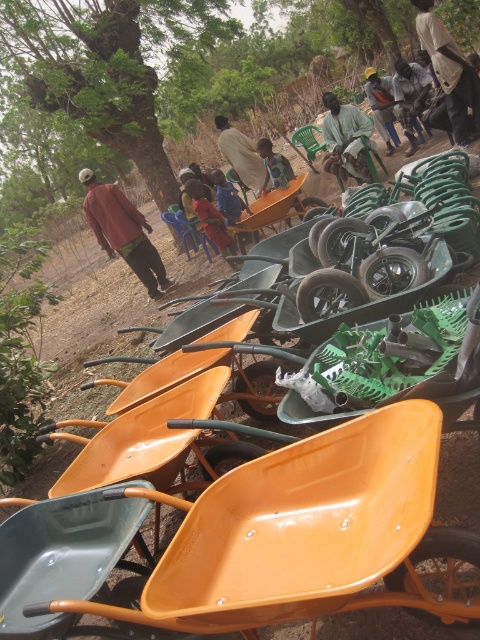
Based on the photo, how far apart are light brown fabric shirt at center and red plastic chair at center?

2.26 meters

Is point (343, 172) less distant than point (228, 241)?

No, it is behind (228, 241).

Identify the location of light brown fabric shirt at center. [346, 138].

Can you confirm if matte red shirt at left is positioned above light brown wooden chair at center?

Actually, matte red shirt at left is below light brown wooden chair at center.

Can you confirm if matte red shirt at left is shorter than light brown wooden chair at center?

No.

Is point (144, 257) behind point (282, 160)?

No, (144, 257) is in front of (282, 160).

I want to click on matte red shirt at left, so click(x=122, y=230).

Who is taller, orange plastic wheelbarrow at center or green plastic wheelbarrow at center?

Standing taller between the two is green plastic wheelbarrow at center.

Which is more to the right, orange plastic wheelbarrow at center or green plastic wheelbarrow at center?

From the viewer's perspective, green plastic wheelbarrow at center appears more on the right side.

This screenshot has height=640, width=480. I want to click on orange plastic wheelbarrow at center, so click(276, 534).

Image resolution: width=480 pixels, height=640 pixels. Identify the location of orange plastic wheelbarrow at center. (276, 534).